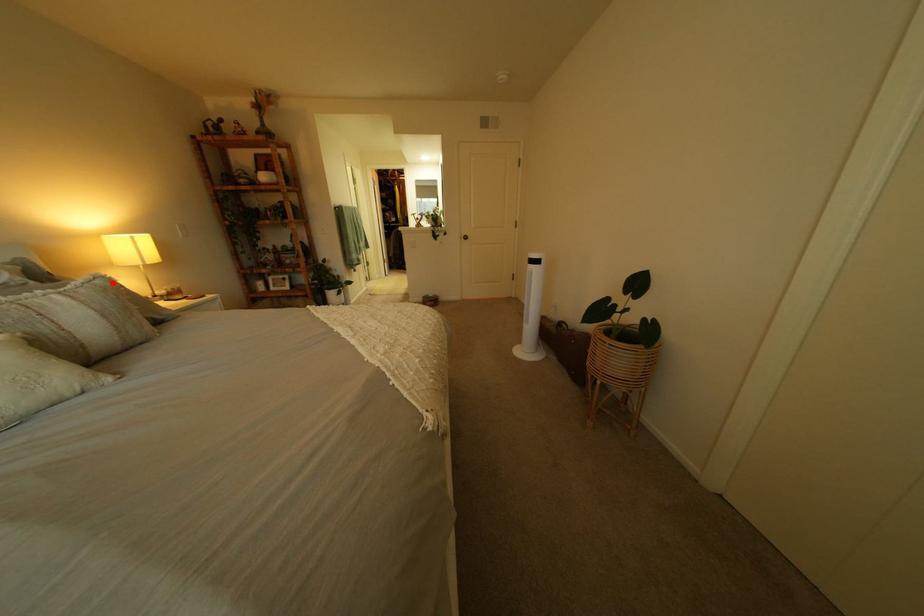
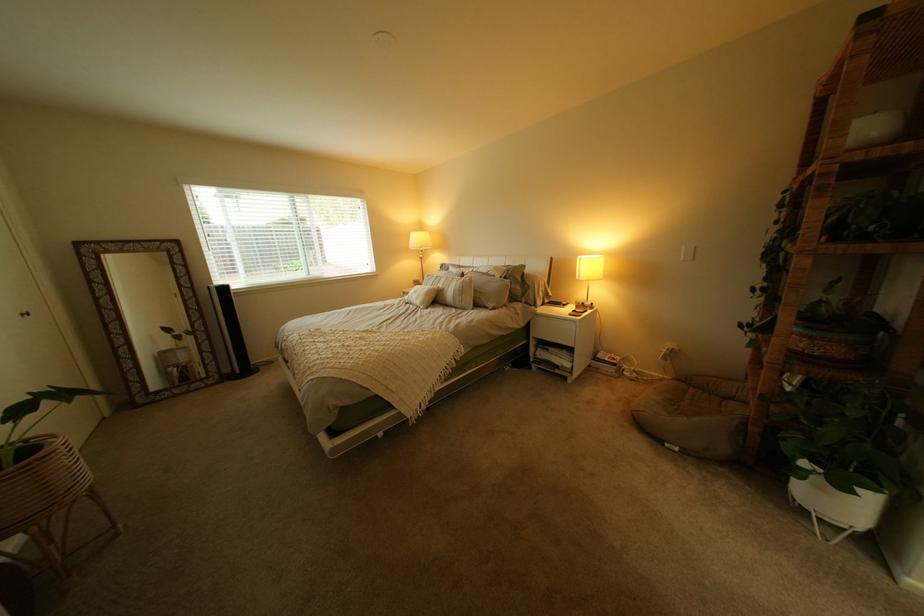
Find the pixel in the second image that matches the highlighted location in the first image.

(482, 280)